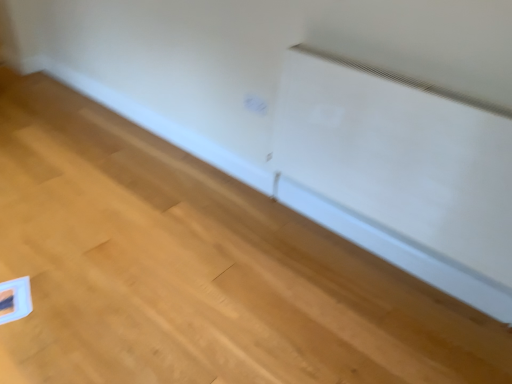
Find the location of a particular element. space that is in front of white matte air conditioning at upper center is located at coordinates (370, 321).